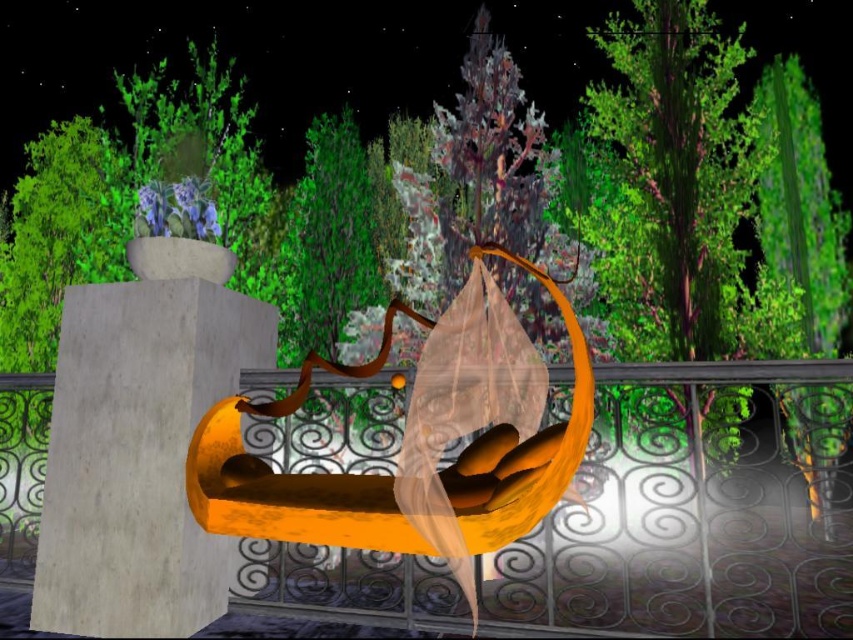
You are standing in the surreal night scene with the orange curved structure and the hanging translucent bag. There is a point marked at coordinates (138,456). What does this point indicate?

The point at coordinates (138,456) marks the location of the concrete block at center.

You are an architect examining a digital model of a night scene with a curved orange structure and greenery. The scene includes a point labeled as point (698, 508). What object does this point correspond to in the scene?

The point (698, 508) corresponds to the metallic wrought iron at center.